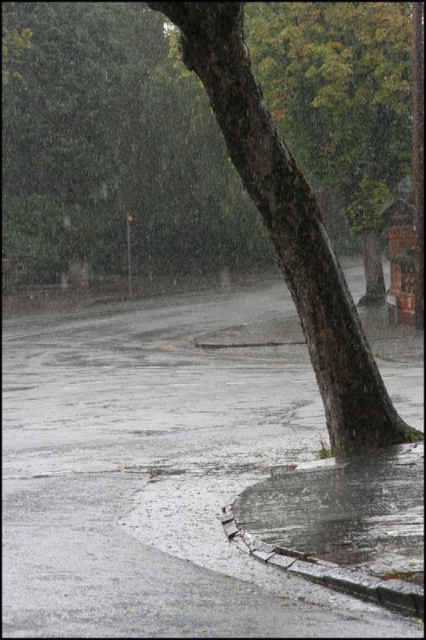
You are a delivery person trying to avoid puddles while walking along the sidewalk. You see the wet asphalt at lower center and the smooth brown tree trunk at center. Which direction should you walk to stay on the drier part of the sidewalk?

The wet asphalt at lower center is positioned on the left side of the smooth brown tree trunk at center. To stay on the drier part of the sidewalk, you should walk to the right side of the smooth brown tree trunk at center since the wet asphalt at lower center indicates a puddle on the left.

You are a city planner assessing the urban space. You notice the smooth bark tree at center and the smooth brown tree trunk at center. Which one would require more space for its root system due to its size?

The smooth bark tree at center is larger in size than the smooth brown tree trunk at center, so it would require more space for its root system.